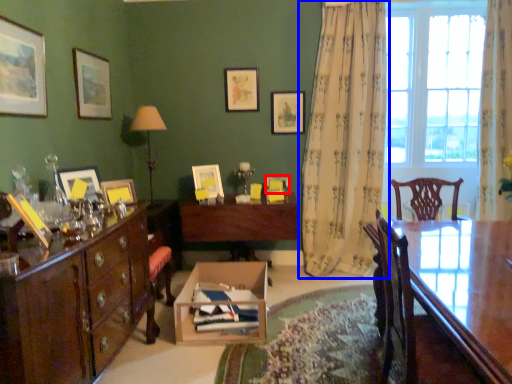
Question: Which point is closer to the camera, picture frame (highlighted by a red box) or curtain (highlighted by a blue box)?

Choices:
 (A) picture frame
 (B) curtain

Answer: (B)